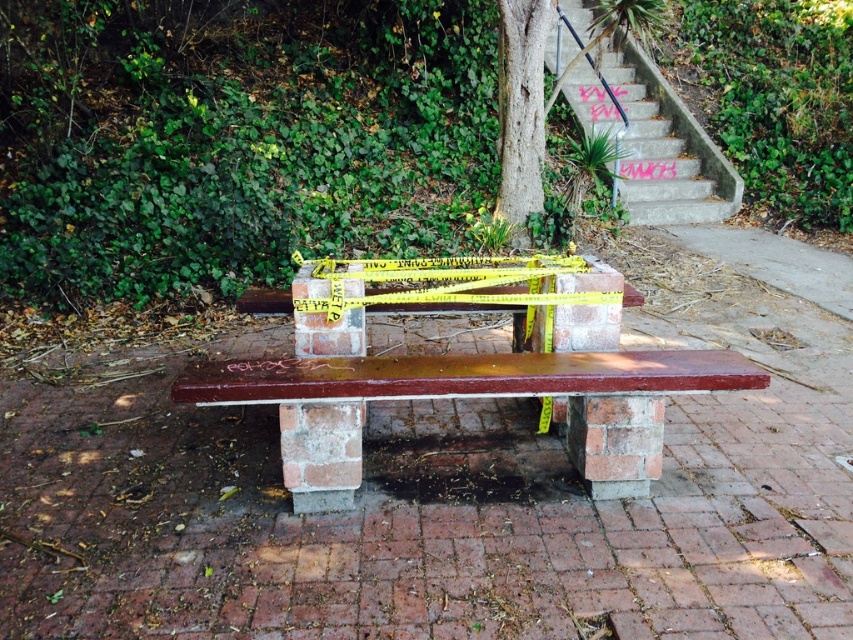
You are a delivery person carrying a large box and need to cross the brick pavement at center and the concrete stairs at upper right. Which path has a wider surface to walk on?

The brick pavement at center has a wider surface than the concrete stairs at upper right, so it is better to walk on the brick pavement at center.

You are a pedestrian trying to reach the top of the concrete stairs at upper right. You see the matte brown bench at center nearby. Which direction should you move relative to the bench to get to the stairs?

The concrete stairs at upper right are to the right of the matte brown bench at center, so you should move to the right of the matte brown bench at center to reach them.